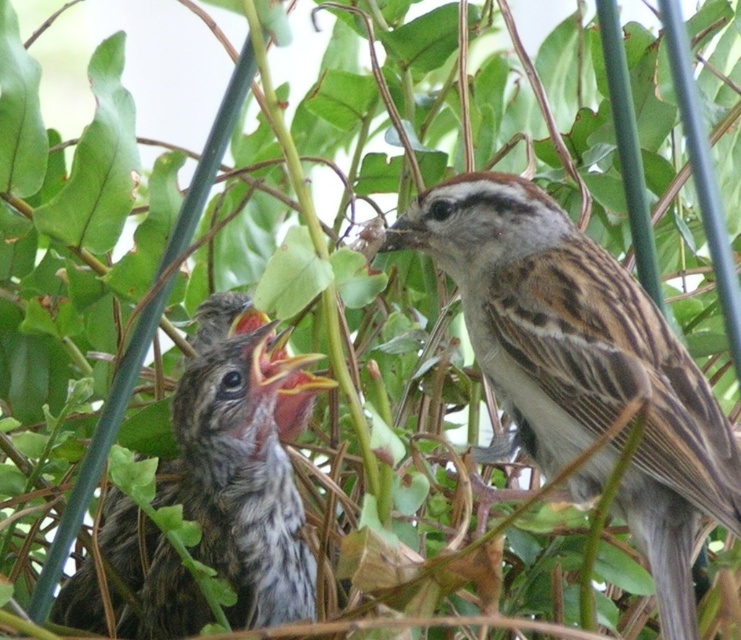
Does brown speckled feathers at upper right have a smaller size compared to speckled brown sparrow at center?

No, brown speckled feathers at upper right is not smaller than speckled brown sparrow at center.

Who is lower down, brown speckled feathers at upper right or speckled brown sparrow at center?

Positioned lower is speckled brown sparrow at center.

Between point (502, 257) and point (250, 561), which one is positioned in front?

Point (250, 561)

Find the location of a particular element. The width and height of the screenshot is (741, 640). brown speckled feathers at upper right is located at coordinates (x=581, y=364).